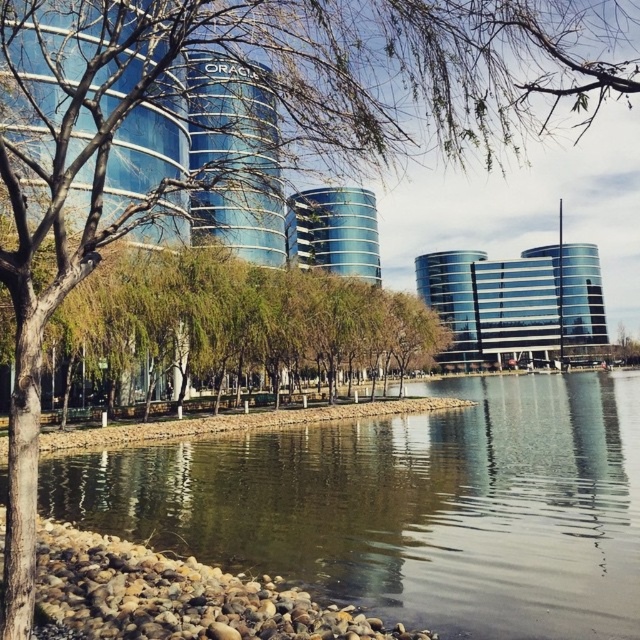
Find the location of `green reflective water at center`. green reflective water at center is located at coordinates (408, 506).

Image resolution: width=640 pixels, height=640 pixels. I want to click on green reflective water at center, so click(x=408, y=506).

At what (x,y) coordinates should I click in order to perform the action: click on green reflective water at center. Please return your answer as a coordinate pair (x, y). Looking at the image, I should click on [x=408, y=506].